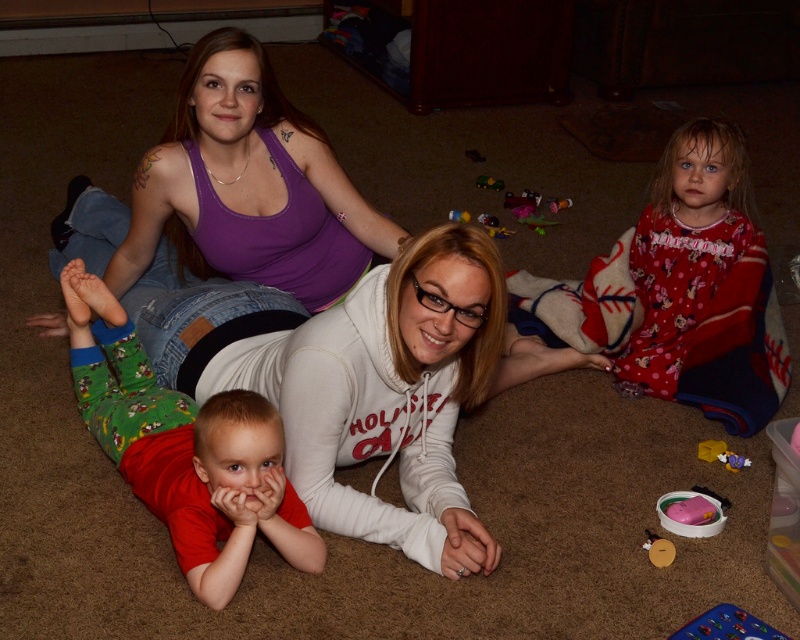
Question: Which point is closer to the camera?

Choices:
 (A) yellow plush toy at lower right
 (B) rubberized plastic toy car at lower right
 (C) green cotton pants at lower left
 (D) green plastic toy car at center

Answer: (C)

Question: Which point is closer to the camera?

Choices:
 (A) (448, 216)
 (B) (56, 236)
 (C) (146, 444)

Answer: (C)

Question: Is green cotton pants at lower left smaller than rubberized plastic toy at center?

Choices:
 (A) yes
 (B) no

Answer: (B)

Question: Is red cotton pajamas at lower right positioned at the back of rubberized plastic toy car at lower right?

Choices:
 (A) yes
 (B) no

Answer: (A)

Question: Considering the real-world distances, which object is farthest from the pink rubber toy at lower right?

Choices:
 (A) red cotton pajamas at lower right
 (B) white fleece hoodie at center
 (C) rubberized plastic toy car at lower right
 (D) yellow plush toy at lower right

Answer: (B)

Question: Is smooth plastic toy at lower right above green plastic toy car at center?

Choices:
 (A) no
 (B) yes

Answer: (A)